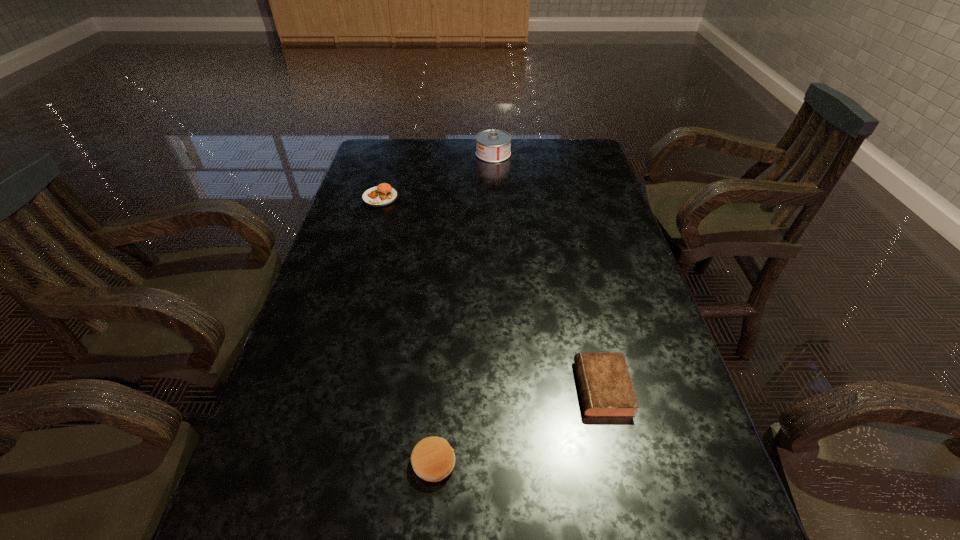
This screenshot has width=960, height=540. What are the coordinates of `free spot between the third object from left to right and the second nearest object` in the screenshot? It's located at tap(548, 271).

Where is `object that is the nearest to the nearest object`? Image resolution: width=960 pixels, height=540 pixels. object that is the nearest to the nearest object is located at coordinates (606, 389).

Locate which object ranks in proximity to the diary. Please provide its 2D coordinates. Your answer should be formatted as a tuple, i.e. [(x, y)], where the tuple contains the x and y coordinates of a point satisfying the conditions above.

[(433, 459)]